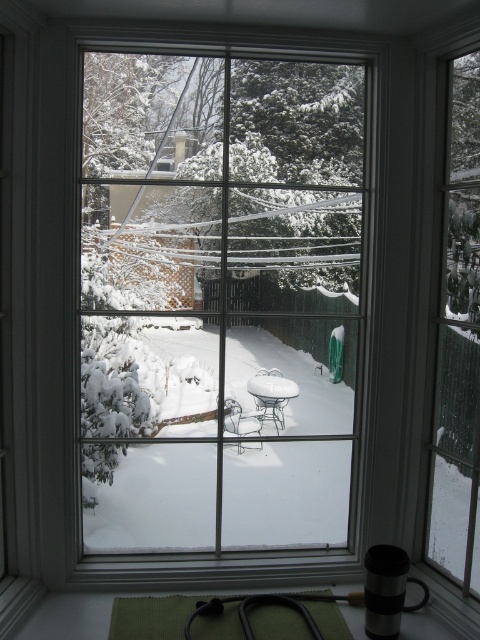
What are the coordinates of the clear glass window at center?

The clear glass window at center is located at coordinates point (219,301).